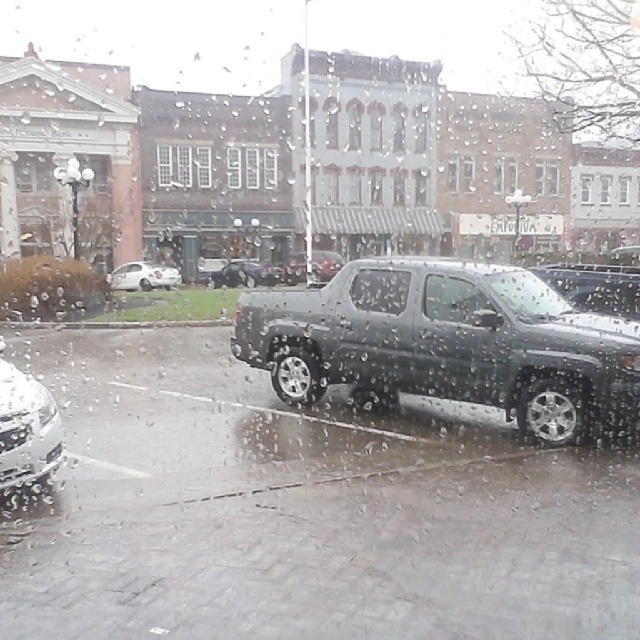
Question: Is shiny silver sedan at lower left positioned behind metallic silver truck at center?

Choices:
 (A) yes
 (B) no

Answer: (B)

Question: In this image, where is shiny silver sedan at lower left located relative to metallic silver truck at center?

Choices:
 (A) below
 (B) above

Answer: (A)

Question: Among these objects, which one is farthest from the camera?

Choices:
 (A) metallic gray truck at center
 (B) white glossy sedan at left
 (C) shiny silver sedan at lower left

Answer: (A)

Question: Which point appears farthest from the camera in this image?

Choices:
 (A) click(113, 280)
 (B) click(365, 381)
 (C) click(8, 406)

Answer: (A)

Question: From the image, what is the correct spatial relationship of white glossy sedan at left in relation to metallic gray truck at center?

Choices:
 (A) left
 (B) right

Answer: (A)

Question: Which point is closer to the camera?

Choices:
 (A) metallic gray truck at center
 (B) metallic silver truck at center
 (C) metallic gray pickup truck at center
 (D) white glossy sedan at left

Answer: (C)